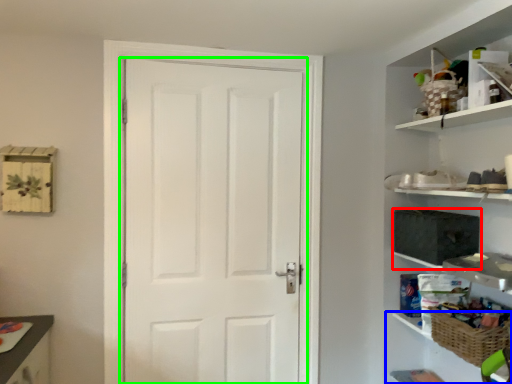
Question: Which object is positioned closest to medicine cabinet (highlighted by a red box)? Select from cabinet (highlighted by a blue box) and door (highlighted by a green box).

Choices:
 (A) cabinet
 (B) door

Answer: (A)